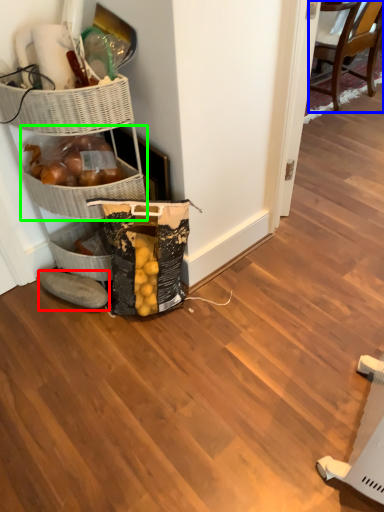
Question: Based on their relative distances, which object is nearer to footwear (highlighted by a red box)? Choose from chair (highlighted by a blue box) and basket (highlighted by a green box).

Choices:
 (A) chair
 (B) basket

Answer: (B)